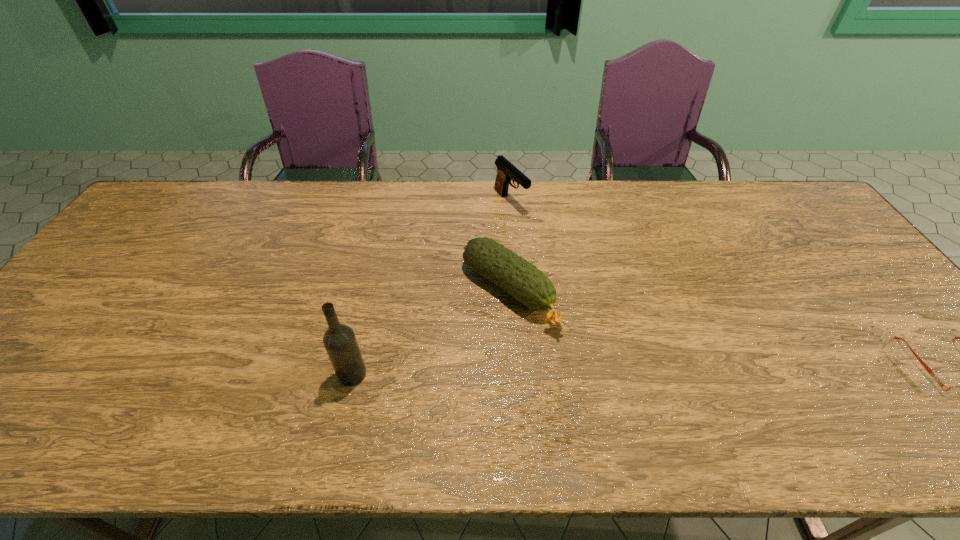
Where is `vacant point located between the vodka and the third tallest object`? The width and height of the screenshot is (960, 540). vacant point located between the vodka and the third tallest object is located at coordinates (431, 334).

I want to click on free space between the leftmost object and the farthest object, so click(431, 288).

The image size is (960, 540). I want to click on blank region between the tallest object and the cucumber, so click(431, 334).

Identify which object is the third closest to the second shortest object. Please provide its 2D coordinates. Your answer should be formatted as a tuple, i.e. [(x, y)], where the tuple contains the x and y coordinates of a point satisfying the conditions above.

[(954, 390)]

The height and width of the screenshot is (540, 960). I want to click on object that is the second closest to the vodka, so click(506, 171).

The height and width of the screenshot is (540, 960). Identify the location of vacant area that satisfies the following two spatial constraints: 1. on the back side of the second shortest object; 2. on the right side of the tallest object. (371, 294).

At what (x,y) coordinates should I click in order to perform the action: click on free point that satisfies the following two spatial constraints: 1. on the back side of the leftmost object; 2. on the right side of the pistol. Please return your answer as a coordinate pair (x, y). Image resolution: width=960 pixels, height=540 pixels. Looking at the image, I should click on (392, 202).

At what (x,y) coordinates should I click in order to perform the action: click on vacant area in the image that satisfies the following two spatial constraints: 1. on the back side of the tallest object; 2. on the right side of the third tallest object. Please return your answer as a coordinate pair (x, y). The height and width of the screenshot is (540, 960). Looking at the image, I should click on (371, 294).

You are a GUI agent. You are given a task and a screenshot of the screen. Output one action in this format:
    pyautogui.click(x=<x>, y=<y>)
    Task: Click on the free point that satisfies the following two spatial constraints: 1. on the back side of the pistol; 2. on the left side of the second shortest object
    
    Given the screenshot: What is the action you would take?
    pyautogui.click(x=503, y=202)